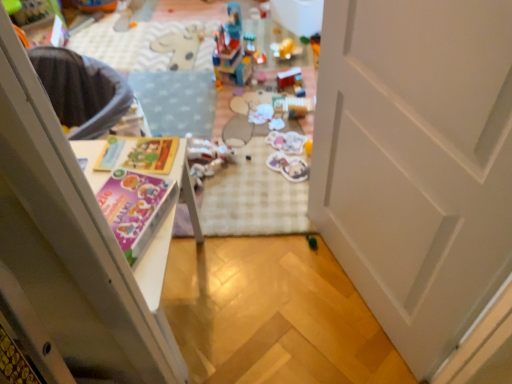
You are a GUI agent. You are given a task and a screenshot of the screen. Output one action in this format:
    pyautogui.click(x=<x>, y=<y>)
    Task: Click on the empty space that is in between translucent plastic stickers at center, arranged as the third toy when viewed from the top, and translucent plastic toy at center, placed as the third toy when sorted from bottom to top
    This screenshot has width=512, height=384.
    Given the screenshot: What is the action you would take?
    pyautogui.click(x=248, y=148)